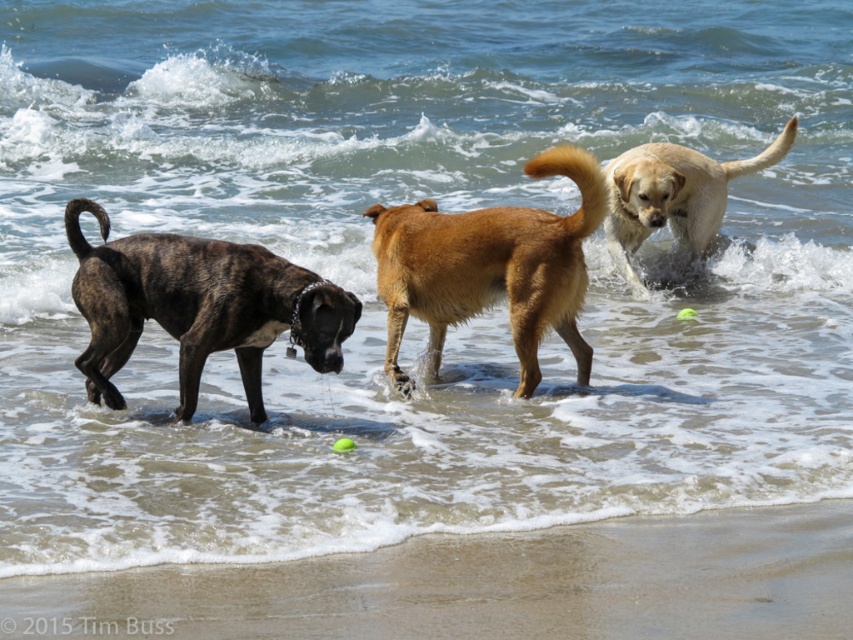
Question: Which object is the closest to the sandy beach at lower center?

Choices:
 (A) light brown fur dog at right
 (B) brindle fur dog at left
 (C) golden fur dog at center

Answer: (B)

Question: Which is nearer to the light brown fur dog at right?

Choices:
 (A) brindle fur dog at left
 (B) golden fur dog at center
 (C) sandy beach at lower center

Answer: (B)

Question: Does brindle fur dog at left have a greater width compared to light brown fur dog at right?

Choices:
 (A) yes
 (B) no

Answer: (B)

Question: Which of the following is the farthest from the observer?

Choices:
 (A) (747, 164)
 (B) (392, 604)

Answer: (A)

Question: Where is golden fur dog at center located in relation to light brown fur dog at right in the image?

Choices:
 (A) above
 (B) below

Answer: (B)

Question: Considering the relative positions of sandy beach at lower center and brindle fur dog at left in the image provided, where is sandy beach at lower center located with respect to brindle fur dog at left?

Choices:
 (A) below
 (B) above

Answer: (A)